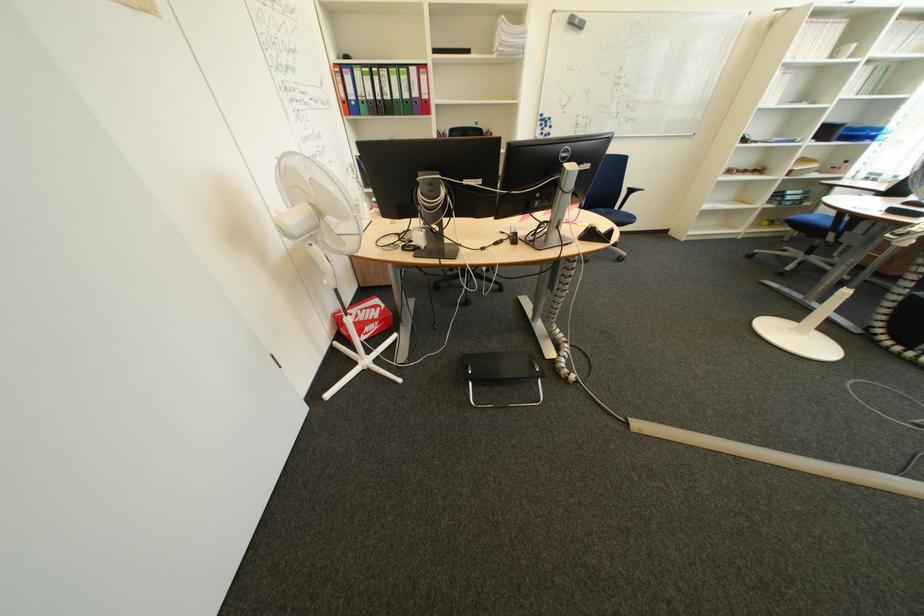
The height and width of the screenshot is (616, 924). In order to click on red shoe box in this screenshot , I will do `click(366, 318)`.